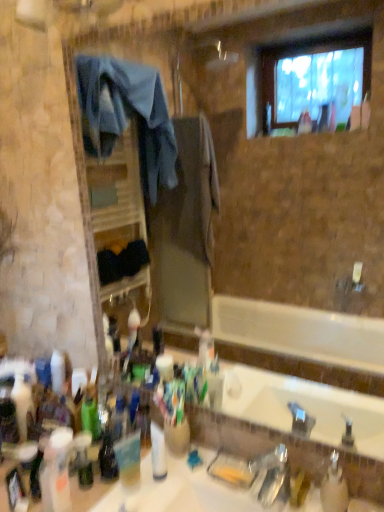
You are a GUI agent. You are given a task and a screenshot of the screen. Output one action in this format:
    pyautogui.click(x=<x>, y=<y>)
    Task: Click on the unoccupied region to the right of translucent plastic cup at lower center
    
    Given the screenshot: What is the action you would take?
    pyautogui.click(x=183, y=489)